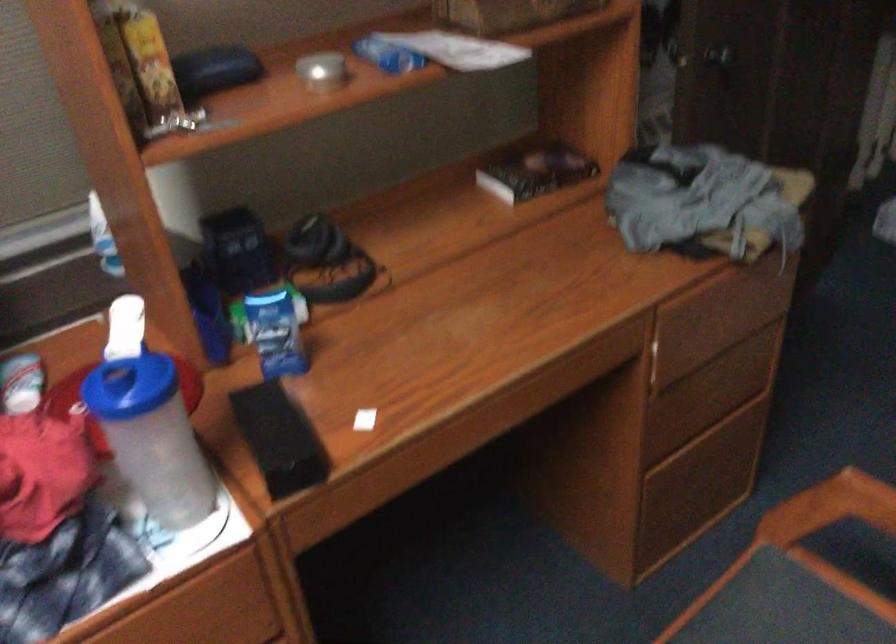
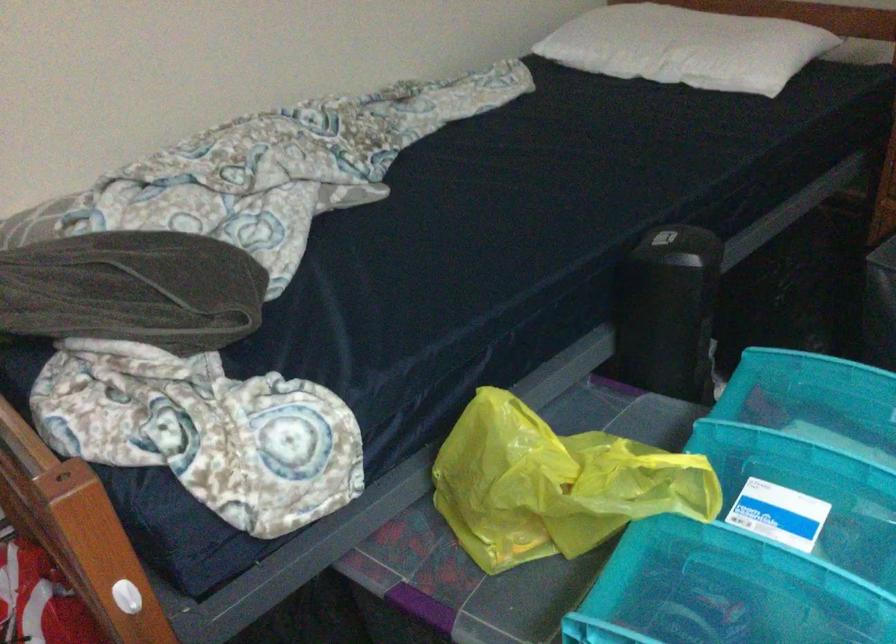
How did the camera likely rotate?

The camera rotated toward right-down.